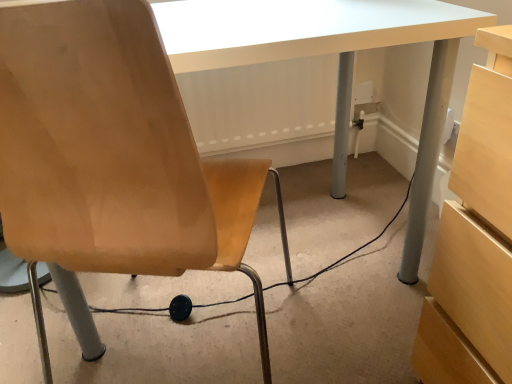
Question: Is black rubber cable at lower center spatially inside matte wood chair at left, or outside of it?

Choices:
 (A) outside
 (B) inside

Answer: (A)

Question: In the image, is black rubber cable at lower center positioned in front of or behind matte wood chair at left?

Choices:
 (A) behind
 (B) front

Answer: (A)

Question: In terms of size, does black rubber cable at lower center appear bigger or smaller than matte wood chair at left?

Choices:
 (A) small
 (B) big

Answer: (A)

Question: Considering the positions of matte wood chair at left and black rubber cable at lower center in the image, is matte wood chair at left bigger or smaller than black rubber cable at lower center?

Choices:
 (A) small
 (B) big

Answer: (B)

Question: From the image's perspective, is matte wood chair at left positioned above or below black rubber cable at lower center?

Choices:
 (A) below
 (B) above

Answer: (B)

Question: Based on their positions, is matte wood chair at left located to the left or right of black rubber cable at lower center?

Choices:
 (A) right
 (B) left

Answer: (B)

Question: Is matte wood chair at left spatially inside black rubber cable at lower center, or outside of it?

Choices:
 (A) outside
 (B) inside

Answer: (A)